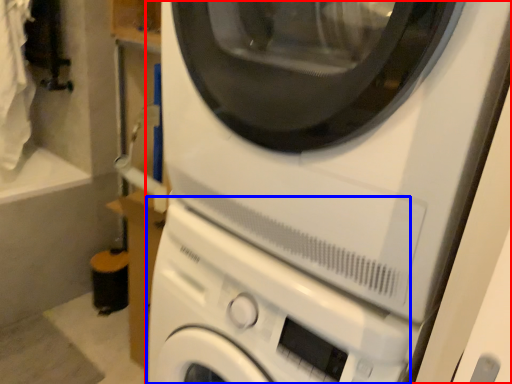
Question: Which point is further to the camera, washing machine (highlighted by a red box) or washing machine (highlighted by a blue box)?

Choices:
 (A) washing machine
 (B) washing machine

Answer: (B)